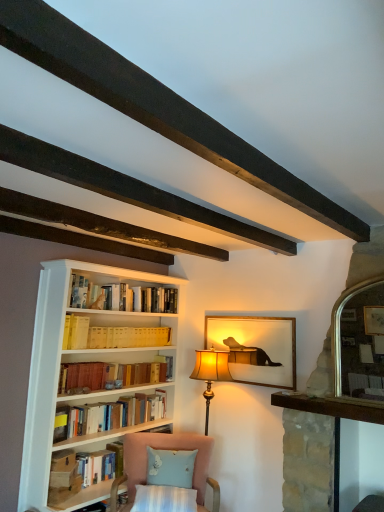
Question: Is matte gold picture frame at center shorter than pink fabric chair at lower center?

Choices:
 (A) yes
 (B) no

Answer: (A)

Question: Considering the relative sizes of matte gold picture frame at center and pink fabric chair at lower center in the image provided, is matte gold picture frame at center smaller than pink fabric chair at lower center?

Choices:
 (A) yes
 (B) no

Answer: (A)

Question: From the image's perspective, would you say matte gold picture frame at center is shown under pink fabric chair at lower center?

Choices:
 (A) no
 (B) yes

Answer: (A)

Question: Considering the relative sizes of matte gold picture frame at center and pink fabric chair at lower center in the image provided, is matte gold picture frame at center wider than pink fabric chair at lower center?

Choices:
 (A) no
 (B) yes

Answer: (A)

Question: From the image's perspective, is matte gold picture frame at center above pink fabric chair at lower center?

Choices:
 (A) no
 (B) yes

Answer: (B)

Question: In terms of height, does pink fabric chair at lower center look taller or shorter compared to yellow cardboard book at center, which is the 3th book from bottom to top?

Choices:
 (A) short
 (B) tall

Answer: (B)

Question: Is pink fabric chair at lower center to the left or to the right of yellow cardboard book at center, which is the 3th book from bottom to top, in the image?

Choices:
 (A) right
 (B) left

Answer: (A)

Question: From a real-world perspective, is pink fabric chair at lower center above or below yellow cardboard book at center, positioned as the first book in top-to-bottom order?

Choices:
 (A) below
 (B) above

Answer: (A)

Question: Is pink fabric chair at lower center inside the boundaries of yellow cardboard book at center, which is the 3th book from bottom to top, or outside?

Choices:
 (A) outside
 (B) inside

Answer: (A)

Question: Relative to pink fabric chair at lower center, is dark wood beam at upper center in front or behind?

Choices:
 (A) behind
 (B) front

Answer: (B)

Question: Considering the positions of dark wood beam at upper center and pink fabric chair at lower center in the image, is dark wood beam at upper center bigger or smaller than pink fabric chair at lower center?

Choices:
 (A) small
 (B) big

Answer: (B)

Question: Does point (183, 121) appear closer or farther from the camera than point (205, 487)?

Choices:
 (A) closer
 (B) farther

Answer: (A)

Question: Is dark wood beam at upper center inside the boundaries of pink fabric chair at lower center, or outside?

Choices:
 (A) inside
 (B) outside

Answer: (B)

Question: From the image's perspective, is hardcover book at lower left, placed as the first book when sorted from bottom to top, located above or below yellow cardboard book at center, positioned as the first book in top-to-bottom order?

Choices:
 (A) above
 (B) below

Answer: (B)

Question: Do you think hardcover book at lower left, placed as the first book when sorted from bottom to top, is within yellow cardboard book at center, which is the 3th book from bottom to top, or outside of it?

Choices:
 (A) outside
 (B) inside

Answer: (A)